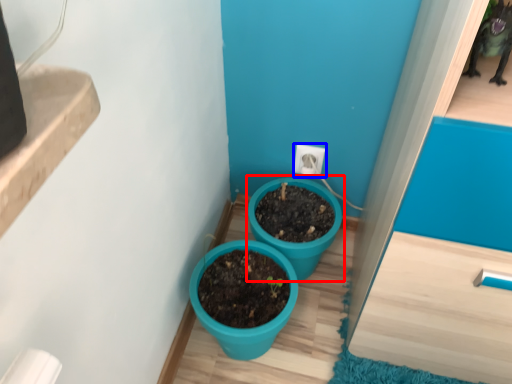
Question: Which object appears farthest to the camera in this image, flowerpot (highlighted by a red box) or electric outlet (highlighted by a blue box)?

Choices:
 (A) flowerpot
 (B) electric outlet

Answer: (B)